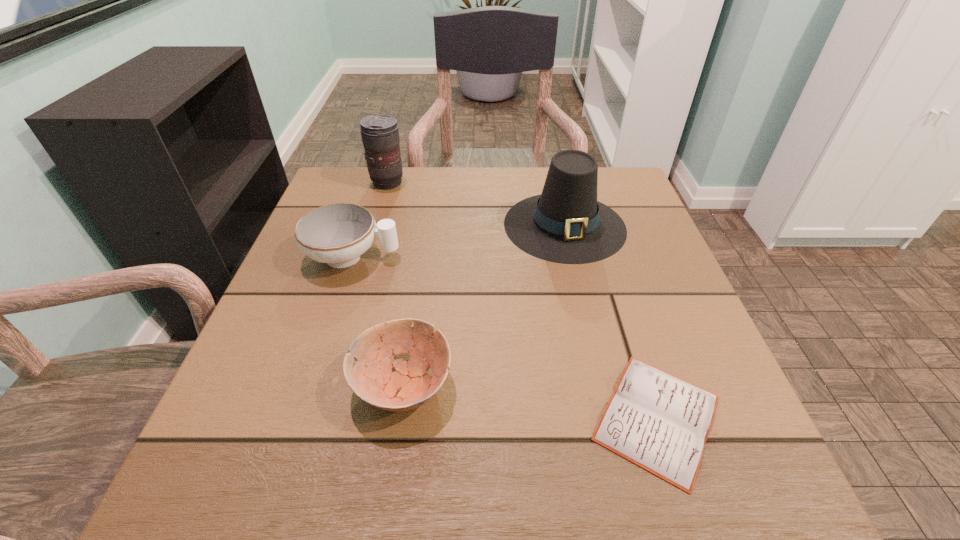
At what (x,y) coordinates should I click in order to perform the action: click on unoccupied position between the hat and the telephoto lens. Please return your answer as a coordinate pair (x, y). This screenshot has height=540, width=960. Looking at the image, I should click on (476, 204).

The image size is (960, 540). In order to click on empty space between the diary and the bowl in this screenshot , I will do `click(530, 401)`.

Find the location of a particular element. unoccupied position between the hat and the farthest object is located at coordinates (476, 204).

This screenshot has width=960, height=540. In order to click on object that can be found as the closest to the chinaware in this screenshot , I will do `click(372, 379)`.

Where is `object that is the third nearest to the bowl`? object that is the third nearest to the bowl is located at coordinates (565, 224).

Where is `free point that satisfies the following two spatial constraints: 1. on the front-facing side of the hat; 2. on the side with the handle of the chinaware`? free point that satisfies the following two spatial constraints: 1. on the front-facing side of the hat; 2. on the side with the handle of the chinaware is located at coordinates (572, 257).

Find the location of a particular element. This screenshot has width=960, height=540. free point that satisfies the following two spatial constraints: 1. on the front side of the diary; 2. on the left side of the fourth tallest object is located at coordinates (398, 417).

Find the location of a particular element. The image size is (960, 540). vacant region that satisfies the following two spatial constraints: 1. on the front-facing side of the hat; 2. on the side with the handle of the chinaware is located at coordinates (572, 257).

The image size is (960, 540). I want to click on vacant space that satisfies the following two spatial constraints: 1. on the side with the handle of the chinaware; 2. on the right side of the diary, so click(300, 417).

The height and width of the screenshot is (540, 960). Identify the location of vacant space that satisfies the following two spatial constraints: 1. on the front-facing side of the shortest object; 2. on the left side of the hat. (610, 417).